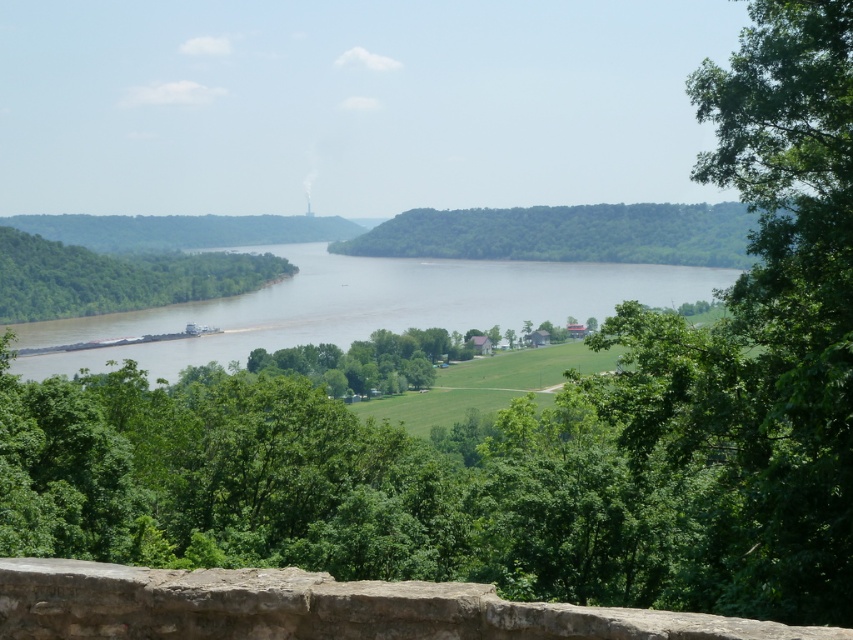
Question: Which object is farther from the camera taking this photo?

Choices:
 (A) brown matte river at center
 (B) green leafy hill at center
 (C) green leafy tree at left

Answer: (C)

Question: Does green leafy hill at center have a smaller size compared to green leafy tree at left?

Choices:
 (A) no
 (B) yes

Answer: (A)

Question: Which point is farther to the camera?

Choices:
 (A) green leafy hill at center
 (B) green leafy tree at left
 (C) rustic stone ledge at lower center

Answer: (B)

Question: Is rustic stone ledge at lower center below green leafy tree at left?

Choices:
 (A) yes
 (B) no

Answer: (A)

Question: Which object is the farthest from the rustic stone ledge at lower center?

Choices:
 (A) green leafy hill at center
 (B) brown matte river at center
 (C) green leafy tree at left

Answer: (A)

Question: Does brown matte river at center come in front of green leafy tree at left?

Choices:
 (A) no
 (B) yes

Answer: (B)